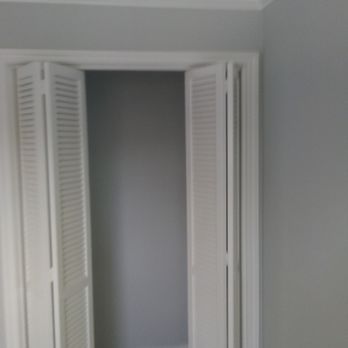
This screenshot has height=348, width=348. In order to click on light in this screenshot , I will do `click(293, 263)`.